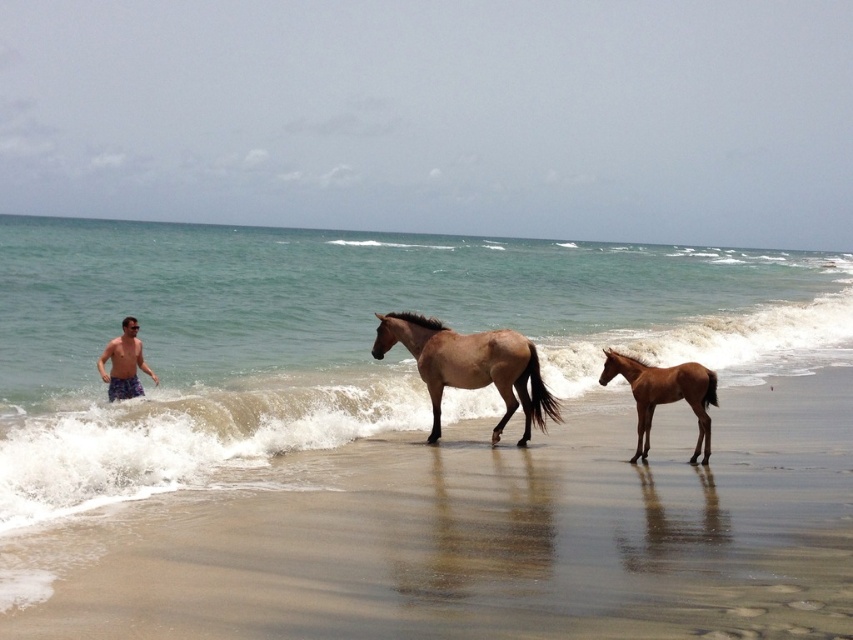
Question: Is brown glossy horse at center below brown glossy horse at lower right?

Choices:
 (A) yes
 (B) no

Answer: (B)

Question: Among these objects, which one is nearest to the camera?

Choices:
 (A) brown sand at lower center
 (B) brown glossy horse at lower right

Answer: (A)

Question: Among these objects, which one is nearest to the camera?

Choices:
 (A) blue plaid shorts at left
 (B) brown sand at lower center

Answer: (B)

Question: Is clear blue water at left closer to camera compared to brown glossy horse at center?

Choices:
 (A) no
 (B) yes

Answer: (A)

Question: Can you confirm if brown sand at lower center is positioned to the right of brown glossy horse at lower right?

Choices:
 (A) yes
 (B) no

Answer: (B)

Question: Which point is closer to the camera?

Choices:
 (A) (126, 374)
 (B) (444, 568)

Answer: (B)